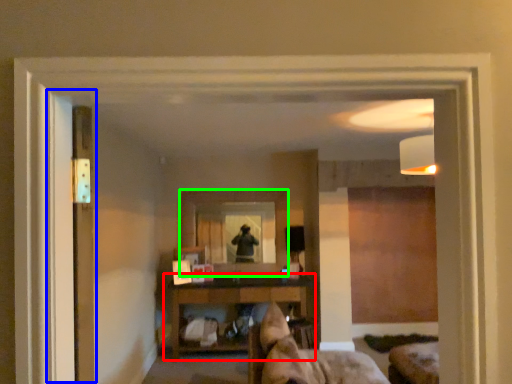
Question: Which object is positioned farthest from shelf (highlighted by a red box)? Select from screen door (highlighted by a blue box) and mirror (highlighted by a green box).

Choices:
 (A) screen door
 (B) mirror

Answer: (A)